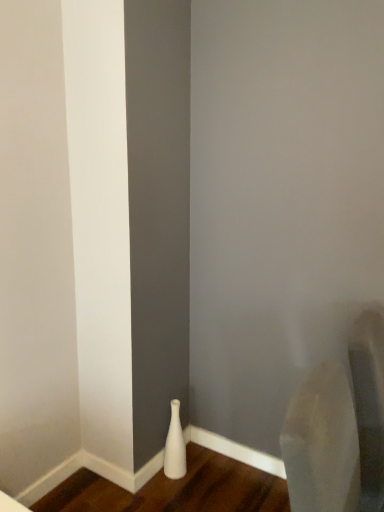
Measure the distance between white glossy vase at lower left and camera.

white glossy vase at lower left is 6.73 feet away from camera.

The height and width of the screenshot is (512, 384). What do you see at coordinates (175, 446) in the screenshot?
I see `white glossy vase at lower left` at bounding box center [175, 446].

This screenshot has width=384, height=512. What are the coordinates of `white glossy vase at lower left` in the screenshot? It's located at (175, 446).

Locate an element on the screen. white glossy vase at lower left is located at coordinates (175, 446).